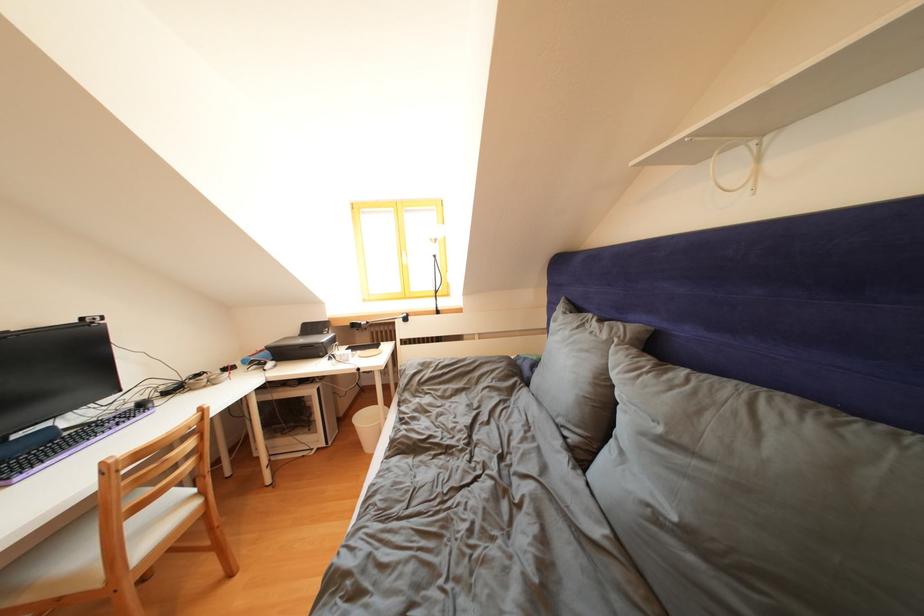
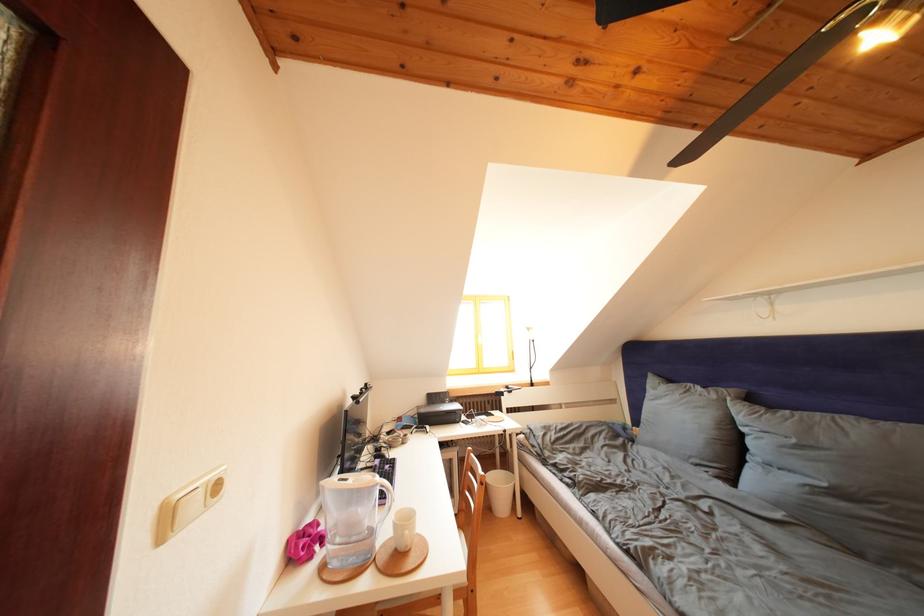
Locate, in the second image, the point that corresponds to point 612,341 in the first image.

(722, 402)